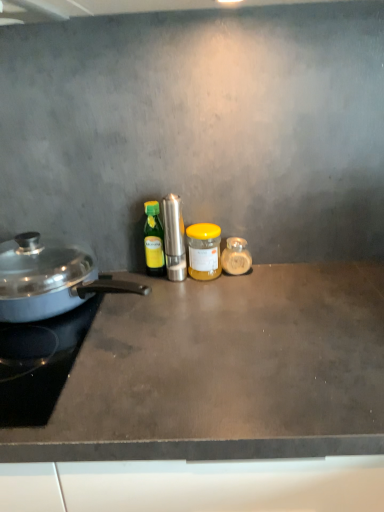
The width and height of the screenshot is (384, 512). Find the location of `unoccupied region to the right of polished stainless steel grinder at center, the third kitchen appliance when ordered from left to right`. unoccupied region to the right of polished stainless steel grinder at center, the third kitchen appliance when ordered from left to right is located at coordinates (251, 288).